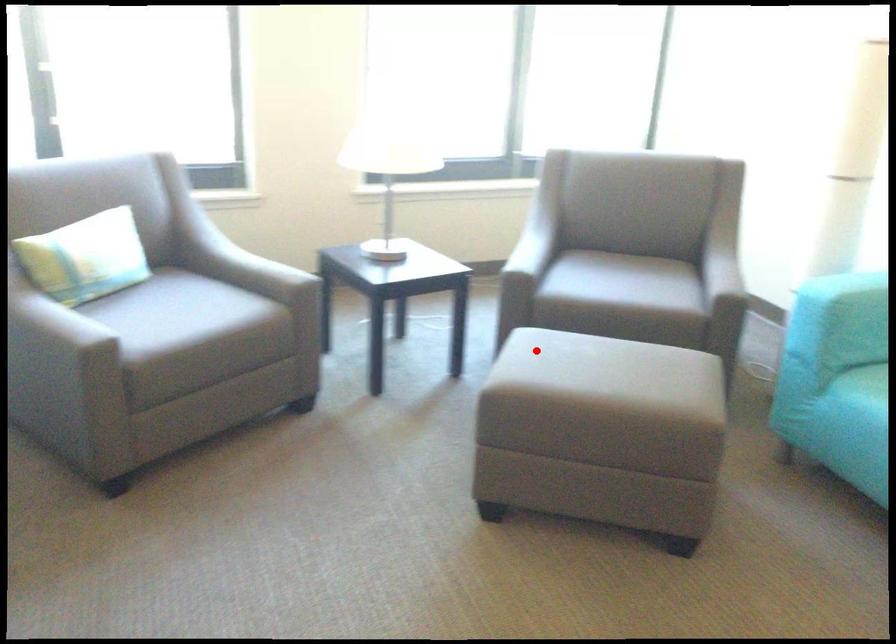
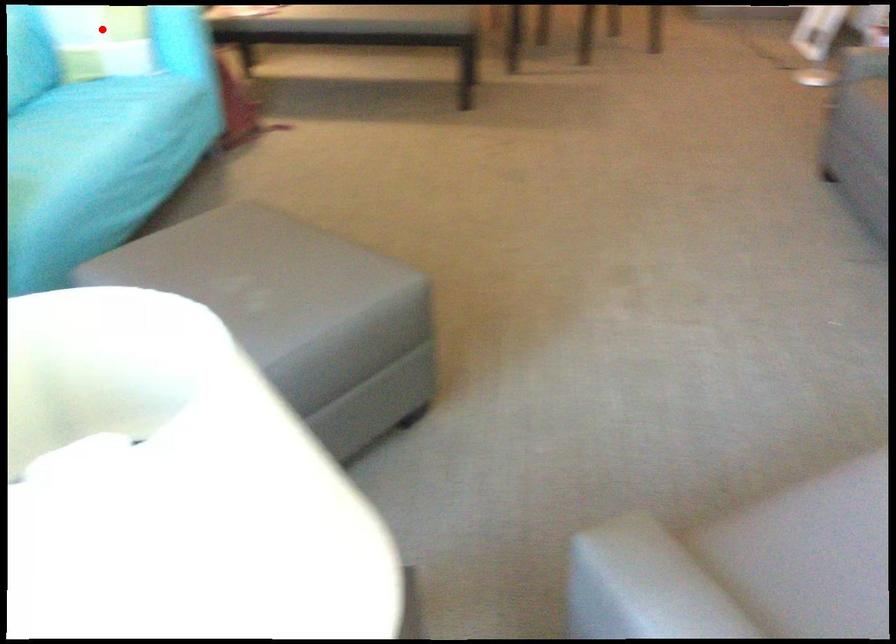
I am providing you with two images of the same scene from different viewpoints. A red point is marked on the first image and another point is marked on the second image. Does the point marked in image1 correspond to the same location as the one in image2?

No